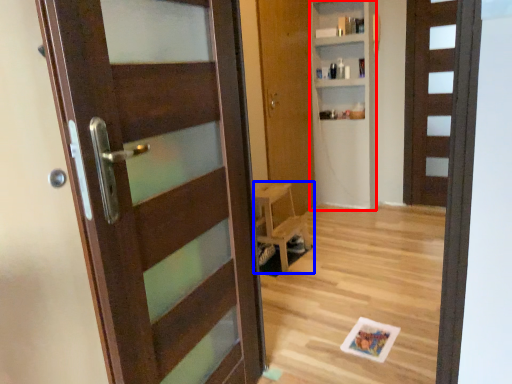
Question: Which point is closer to the camera, bookshelf (highlighted by a red box) or furniture (highlighted by a blue box)?

Choices:
 (A) bookshelf
 (B) furniture

Answer: (B)